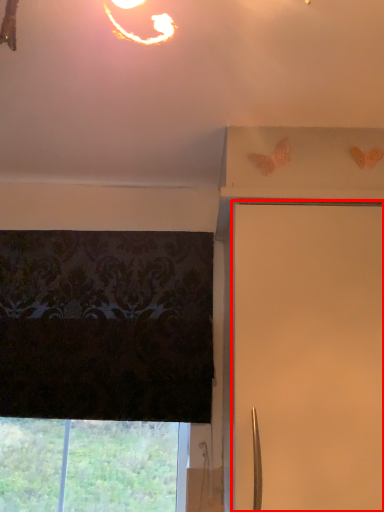
Question: From the image's perspective, what is the correct spatial relationship of shutter (annotated by the red box) in relation to window?

Choices:
 (A) below
 (B) above

Answer: (B)